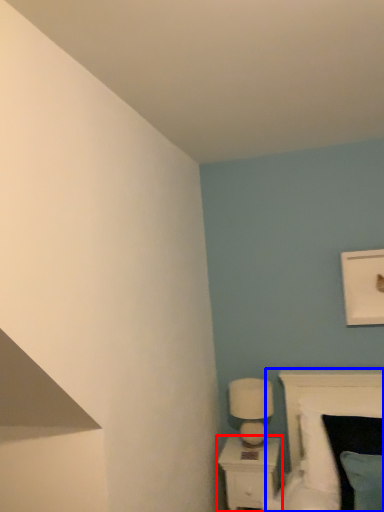
Question: Among these objects, which one is farthest to the camera, nightstand (highlighted by a red box) or bed (highlighted by a blue box)?

Choices:
 (A) nightstand
 (B) bed

Answer: (A)